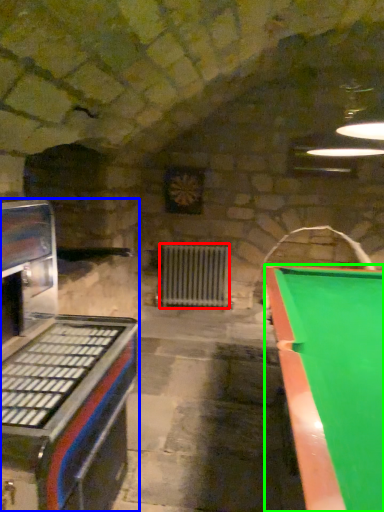
Question: Estimate the real-world distances between objects in this image. Which object is farther from radiator (highlighted by a red box), appliance (highlighted by a blue box) or billiard table (highlighted by a green box)?

Choices:
 (A) appliance
 (B) billiard table

Answer: (A)